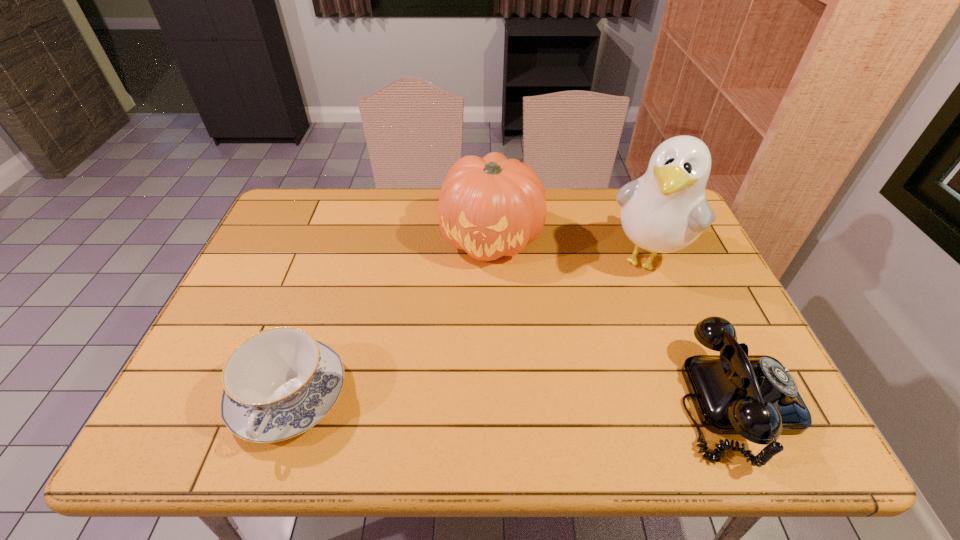
Identify the location of object that is at the far right corner. This screenshot has width=960, height=540. (665, 210).

The image size is (960, 540). Find the location of `object at the near right corner`. object at the near right corner is located at coordinates (755, 396).

At what (x,y) coordinates should I click in order to perform the action: click on vacant space at the far edge of the desktop. Please return your answer as a coordinate pair (x, y). Looking at the image, I should click on (585, 192).

Identify the location of vacant area at the near edge of the desktop. The image size is (960, 540). (486, 377).

This screenshot has height=540, width=960. In the image, there is a desktop. Find the location of `vacant area at the left edge`. vacant area at the left edge is located at coordinates (274, 245).

This screenshot has width=960, height=540. I want to click on vacant space at the far left corner of the desktop, so click(x=316, y=219).

This screenshot has width=960, height=540. In order to click on unoccupied area between the third tallest object and the pumpkin in this screenshot , I will do `click(613, 320)`.

I want to click on vacant space that's between the tallest object and the third tallest object, so click(692, 329).

Identify the location of free space between the second tallest object and the leftmost object. The image size is (960, 540). tap(390, 318).

The image size is (960, 540). In order to click on vacant area between the tallest object and the telephone in this screenshot , I will do `click(692, 329)`.